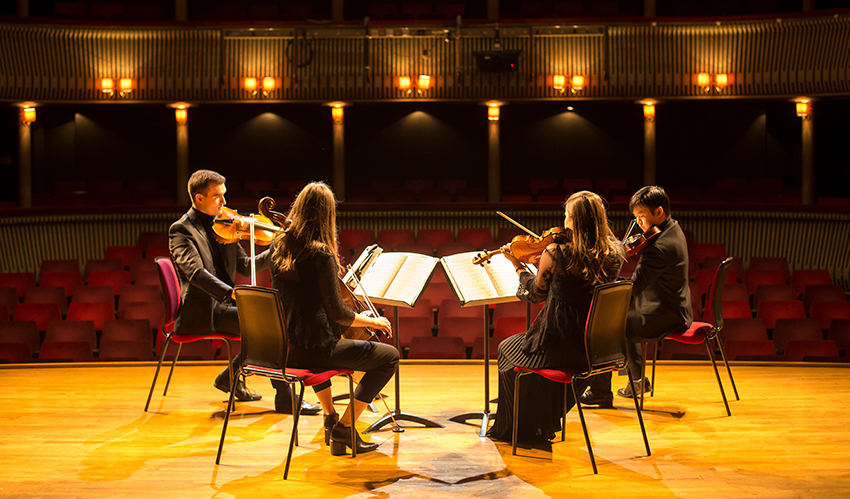
Identify the location of theater seats red. (98, 293), (767, 314), (445, 320).